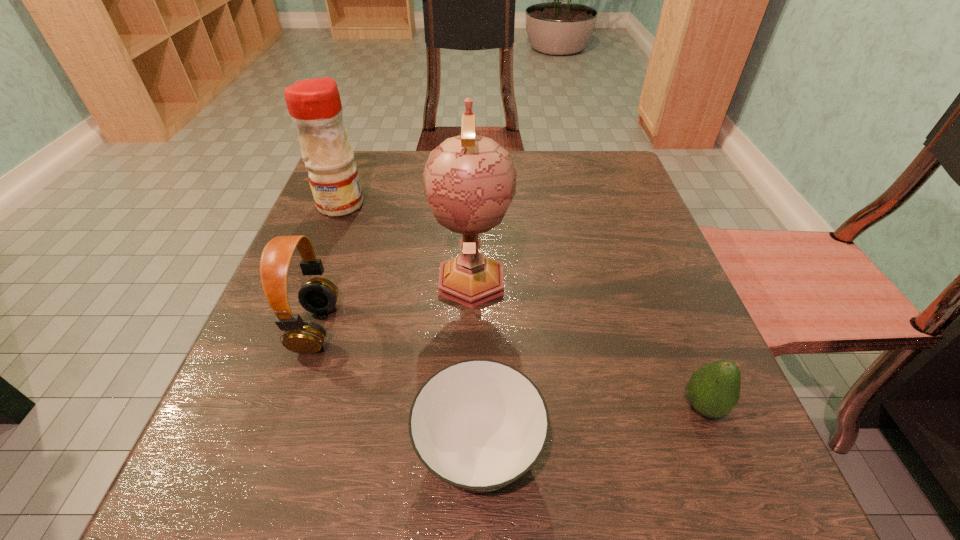
Locate an element on the screen. the tallest object is located at coordinates (469, 180).

Where is `condiment`? The height and width of the screenshot is (540, 960). condiment is located at coordinates (314, 105).

Find the location of a particular element. the farthest object is located at coordinates (314, 105).

Locate an element on the screen. This screenshot has height=540, width=960. headset is located at coordinates (x=318, y=295).

Where is `the rightmost object`? The image size is (960, 540). the rightmost object is located at coordinates (713, 390).

This screenshot has width=960, height=540. What are the coordinates of `soup bowl` in the screenshot? It's located at (478, 425).

Image resolution: width=960 pixels, height=540 pixels. In order to click on free spot located 0.290m on the front-facing side of the globe in this screenshot , I will do `click(468, 496)`.

Where is `vacant space located on the front of the farthest object`? The width and height of the screenshot is (960, 540). vacant space located on the front of the farthest object is located at coordinates (276, 366).

The width and height of the screenshot is (960, 540). I want to click on vacant space located 0.280m on the ear cups of the headset, so click(x=504, y=328).

Image resolution: width=960 pixels, height=540 pixels. I want to click on vacant space located 0.060m on the back of the rightmost object, so coord(682,354).